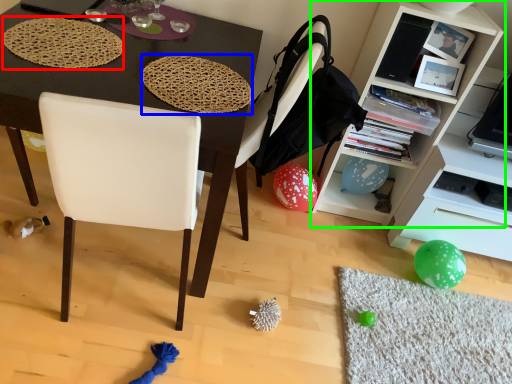
Question: Considering the real-world distances, which object is farthest from mat (highlighted by a red box)? mat (highlighted by a blue box) or cabinetry (highlighted by a green box)?

Choices:
 (A) mat
 (B) cabinetry

Answer: (B)